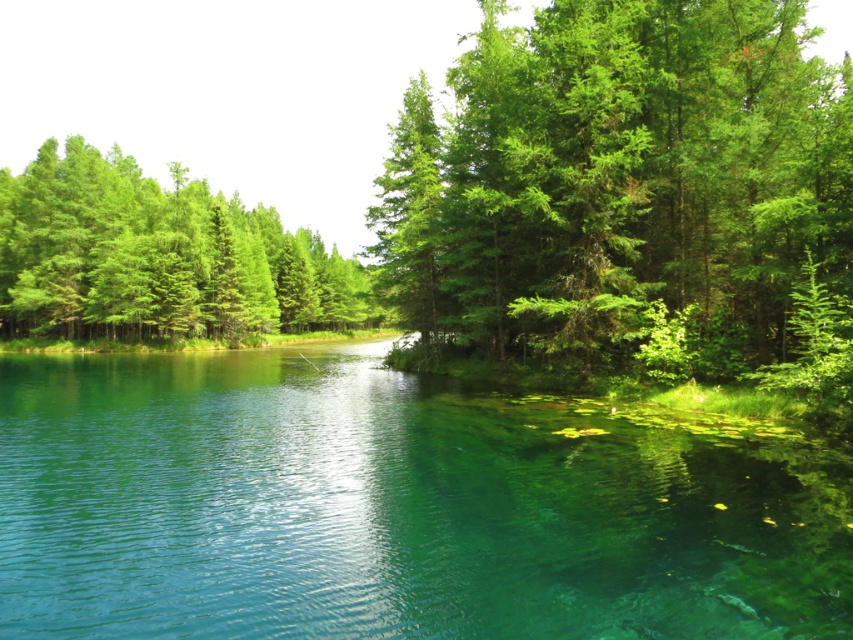
Question: Which point appears farthest from the camera in this image?

Choices:
 (A) (207, 276)
 (B) (759, 22)
 (C) (45, 403)

Answer: (A)

Question: Does transparent water at center appear over green matte trees at upper left?

Choices:
 (A) no
 (B) yes

Answer: (A)

Question: In this image, where is green leafy tree at upper center located relative to green matte trees at upper left?

Choices:
 (A) above
 (B) below

Answer: (B)

Question: Considering the real-world distances, which object is closest to the green leafy tree at upper center?

Choices:
 (A) green matte trees at upper left
 (B) transparent water at center

Answer: (B)

Question: Among these objects, which one is farthest from the camera?

Choices:
 (A) green leafy tree at upper center
 (B) green matte trees at upper left
 (C) transparent water at center

Answer: (B)

Question: Is transparent water at center further to the viewer compared to green leafy tree at upper center?

Choices:
 (A) yes
 (B) no

Answer: (B)